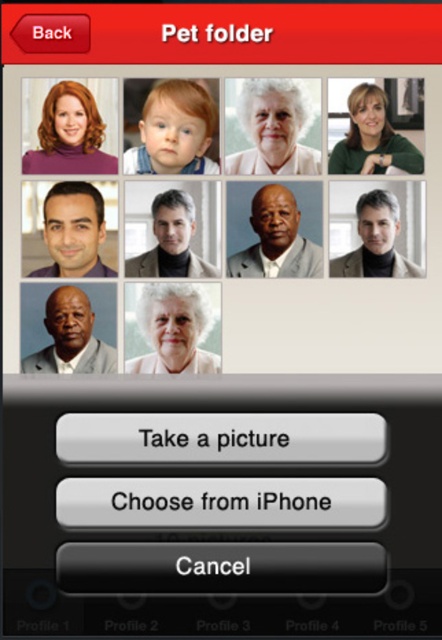
Question: Does black glossy button at bottom center have a greater width compared to white matte portrait at center?

Choices:
 (A) yes
 (B) no

Answer: (A)

Question: Based on their relative distances, which object is nearer to the matte black jacket at upper right?

Choices:
 (A) matte purple turtleneck at upper left
 (B) matte black jacket at center
 (C) matte black laptop at upper left

Answer: (C)

Question: Is matte black man at center left below green matte shirt at upper right?

Choices:
 (A) yes
 (B) no

Answer: (A)

Question: Which point is closer to the camera?

Choices:
 (A) black glossy button at bottom center
 (B) matte purple turtleneck at upper left
 (C) matte plastic baby at upper center

Answer: (A)

Question: Estimate the real-world distances between objects in this image. Which object is farther from the matte plastic baby at upper center?

Choices:
 (A) matte black man at center left
 (B) matte black jacket at center
 (C) black glossy button at bottom center

Answer: (C)

Question: Observing the image, what is the correct spatial positioning of matte purple turtleneck at upper left in reference to green matte shirt at upper right?

Choices:
 (A) above
 (B) below

Answer: (A)